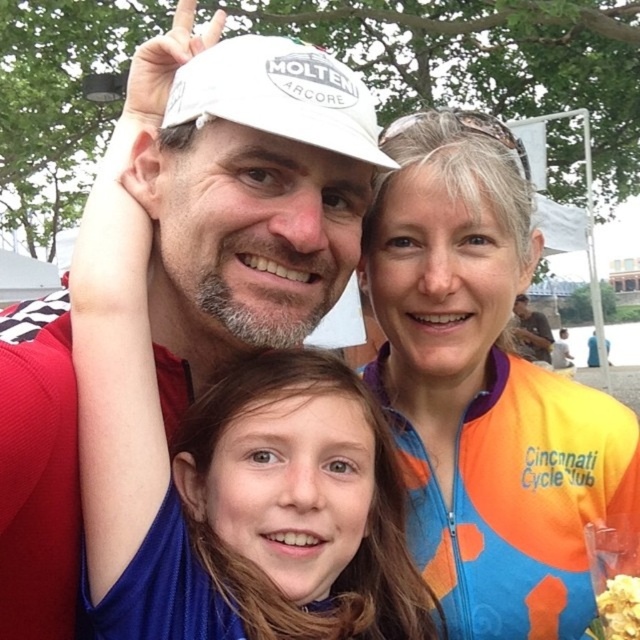
You are at a cycling event and see the orange printed jersey at center and the crunchy popcorn at lower right. Which object is higher up in the image?

The orange printed jersey at center is taller than the crunchy popcorn at lower right, so the orange printed jersey at center is higher up in the image.

You are standing at the origin of the coordinate system in the image. You want to walk to the point at the rightmost edge of the image. Which point, point at (465, 205) or point at (604, 627), is closer to your destination?

Point at (604, 627) is closer to the rightmost edge of the image because it has a higher x coordinate value than point at (465, 205).

Based on the scene description, can you identify which object corresponds to the coordinates point (483, 388)?

The orange printed jersey at center corresponds to the coordinates point (483, 388).